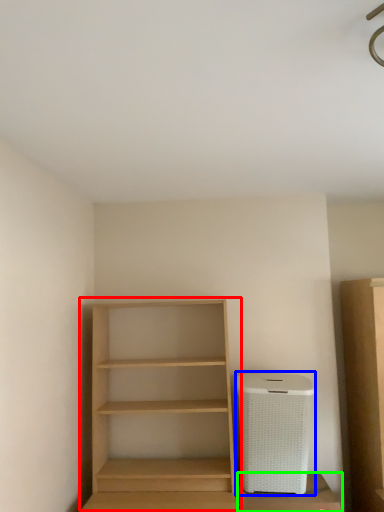
Question: Which is farther away from shelf (highlighted by a red box)? appliance (highlighted by a blue box) or cabinetry (highlighted by a green box)?

Choices:
 (A) appliance
 (B) cabinetry

Answer: (B)